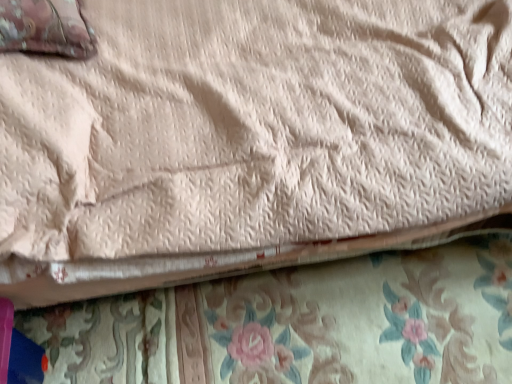
In order to face floral fabric at lower center, should I rotate leftwards or rightwards?

You should rotate right by 4.533 degrees.

Identify the location of floral fabric at lower center. (300, 324).

The image size is (512, 384). Describe the element at coordinates (300, 324) in the screenshot. I see `floral fabric at lower center` at that location.

Describe the element at coordinates (45, 28) in the screenshot. I see `velvet-like pink pillow at upper left` at that location.

Locate an element on the screen. This screenshot has width=512, height=384. velvet-like pink pillow at upper left is located at coordinates (45, 28).

Locate an element on the screen. This screenshot has width=512, height=384. floral fabric at lower center is located at coordinates (300, 324).

Visually, is velvet-like pink pillow at upper left positioned to the left or to the right of floral fabric at lower center?

velvet-like pink pillow at upper left is positioned on floral fabric at lower center's left side.

Is velvet-like pink pillow at upper left positioned behind floral fabric at lower center?

No, velvet-like pink pillow at upper left is closer to the viewer.

Which is behind, point (34, 3) or point (221, 330)?

The point (221, 330) is behind.

From the image's perspective, between velvet-like pink pillow at upper left and floral fabric at lower center, who is located below?

floral fabric at lower center.

From a real-world perspective, is velvet-like pink pillow at upper left physically above floral fabric at lower center?

Indeed, from a real-world perspective, velvet-like pink pillow at upper left stands above floral fabric at lower center.

Does velvet-like pink pillow at upper left have a greater width compared to floral fabric at lower center?

No, velvet-like pink pillow at upper left is not wider than floral fabric at lower center.

In terms of height, does velvet-like pink pillow at upper left look taller or shorter compared to floral fabric at lower center?

Considering their sizes, velvet-like pink pillow at upper left has more height than floral fabric at lower center.

Considering the sizes of velvet-like pink pillow at upper left and floral fabric at lower center in the image, is velvet-like pink pillow at upper left bigger or smaller than floral fabric at lower center?

Considering their sizes, velvet-like pink pillow at upper left takes up more space than floral fabric at lower center.

Could floral fabric at lower center be considered to be inside velvet-like pink pillow at upper left?

No, floral fabric at lower center is not inside velvet-like pink pillow at upper left.

Is velvet-like pink pillow at upper left next to floral fabric at lower center and touching it?

velvet-like pink pillow at upper left is not next to floral fabric at lower center, and they're not touching.

Is velvet-like pink pillow at upper left positioned with its back to floral fabric at lower center?

No, velvet-like pink pillow at upper left's orientation is not away from floral fabric at lower center.

What's the angular difference between velvet-like pink pillow at upper left and floral fabric at lower center's facing directions?

The facing directions of velvet-like pink pillow at upper left and floral fabric at lower center are 97.9 degrees apart.

Find the location of a particular element. pillow in front of the floral fabric at lower center is located at coordinates (45, 28).

Which is more to the right, floral fabric at lower center or velvet-like pink pillow at upper left?

floral fabric at lower center is more to the right.

Is the depth of floral fabric at lower center less than that of velvet-like pink pillow at upper left?

No, it is behind velvet-like pink pillow at upper left.

Does point (416, 265) appear closer or farther from the camera than point (23, 7)?

Point (416, 265).

From the image's perspective, is floral fabric at lower center located above velvet-like pink pillow at upper left?

Actually, floral fabric at lower center appears below velvet-like pink pillow at upper left in the image.

From a real-world perspective, is floral fabric at lower center above or below velvet-like pink pillow at upper left?

In terms of real-world spatial position, floral fabric at lower center is below velvet-like pink pillow at upper left.

Which object is wider, floral fabric at lower center or velvet-like pink pillow at upper left?

floral fabric at lower center.

Can you confirm if floral fabric at lower center is taller than velvet-like pink pillow at upper left?

No.

Who is smaller, floral fabric at lower center or velvet-like pink pillow at upper left?

floral fabric at lower center is smaller.

Which is correct: floral fabric at lower center is inside velvet-like pink pillow at upper left, or outside of it?

floral fabric at lower center exists outside the volume of velvet-like pink pillow at upper left.

Is floral fabric at lower center with velvet-like pink pillow at upper left?

floral fabric at lower center is not next to velvet-like pink pillow at upper left, and they're not touching.

Is floral fabric at lower center facing away from velvet-like pink pillow at upper left?

Answer: No, velvet-like pink pillow at upper left is not at the back of floral fabric at lower center.

The width and height of the screenshot is (512, 384). Find the location of `blanket behind the velvet-like pink pillow at upper left`. blanket behind the velvet-like pink pillow at upper left is located at coordinates click(300, 324).

This screenshot has width=512, height=384. In order to click on pillow above the floral fabric at lower center (from a real-world perspective) in this screenshot , I will do pos(45,28).

At what (x,y) coordinates should I click in order to perform the action: click on blanket below the velvet-like pink pillow at upper left (from a real-world perspective). Please return your answer as a coordinate pair (x, y). The height and width of the screenshot is (384, 512). Looking at the image, I should click on (300, 324).